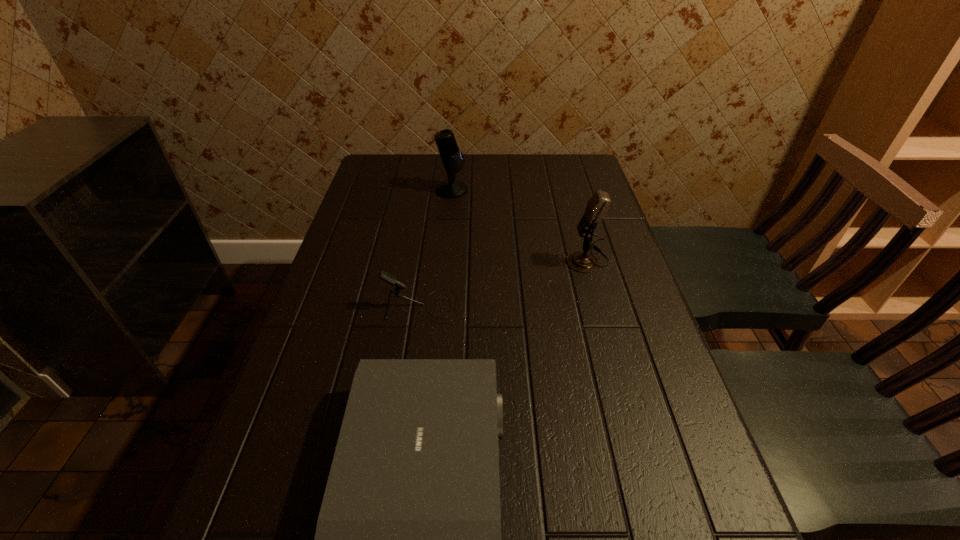
Find the location of `object present at the far edge`. object present at the far edge is located at coordinates (452, 158).

This screenshot has height=540, width=960. What are the coordinates of `object that is positioned at the right edge` in the screenshot? It's located at (598, 205).

Where is `vacant region at the far edge of the desktop`? vacant region at the far edge of the desktop is located at coordinates (483, 178).

Identify the location of vacant space at the left edge of the desktop. This screenshot has height=540, width=960. (394, 210).

This screenshot has height=540, width=960. I want to click on vacant space at the right edge, so click(x=662, y=352).

In the image, there is a desktop. Identify the location of free space at the far left corner. Image resolution: width=960 pixels, height=540 pixels. (406, 173).

This screenshot has width=960, height=540. In order to click on vacant space at the far right corner of the desktop in this screenshot , I will do `click(568, 184)`.

Image resolution: width=960 pixels, height=540 pixels. What are the coordinates of `vacant point located between the farthest object and the third farthest object` in the screenshot? It's located at (436, 248).

The height and width of the screenshot is (540, 960). What are the coordinates of `free space between the farthest microphone and the rightmost microphone` in the screenshot? It's located at (x=519, y=225).

Locate which object is the second closest to the nearest object. Please provide its 2D coordinates. Your answer should be formatted as a tuple, i.e. [(x, y)], where the tuple contains the x and y coordinates of a point satisfying the conditions above.

[(598, 205)]